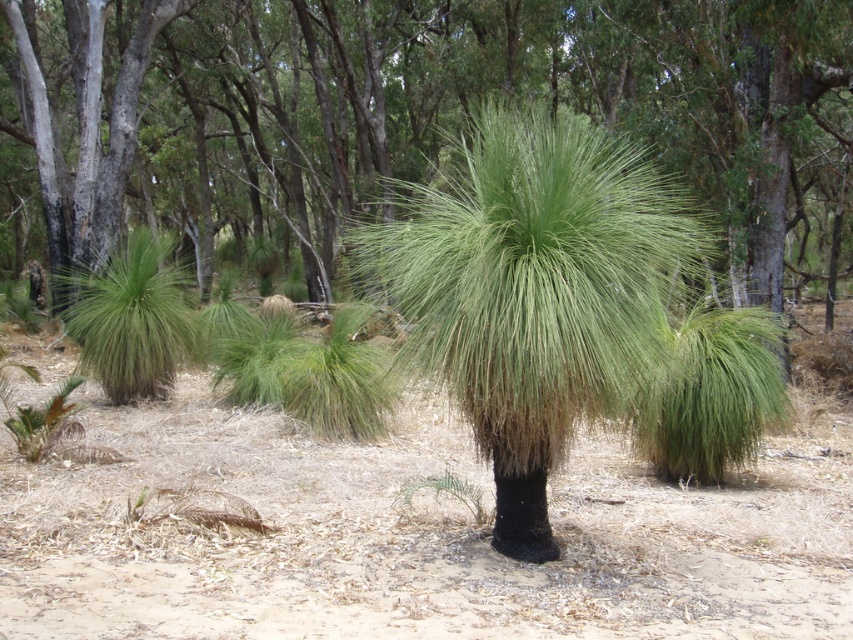
Looking at this image, which of these two, brown dry dirt at center or green fibrous palm tree at center, stands shorter?

brown dry dirt at center

I want to click on brown dry dirt at center, so click(418, 536).

Measure the distance between brown dry dirt at center and camera.

brown dry dirt at center and camera are 12.32 feet apart from each other.

Identify the location of brown dry dirt at center. (418, 536).

Is green fibrous palm tree at center wider than green fibrous palm tree at left?

Yes, green fibrous palm tree at center is wider than green fibrous palm tree at left.

At what (x,y) coordinates should I click in order to perform the action: click on green fibrous palm tree at center. Please return your answer as a coordinate pair (x, y). Image resolution: width=853 pixels, height=640 pixels. Looking at the image, I should click on (537, 292).

Does green fibrous plant at center appear on the left side of green fibrous palm tree at left?

Incorrect, green fibrous plant at center is not on the left side of green fibrous palm tree at left.

Who is shorter, green fibrous plant at center or green fibrous palm tree at left?

green fibrous palm tree at left

Is point (59, 248) closer to camera compared to point (103, 269)?

No.

Identify the location of green fibrous plant at center. (431, 112).